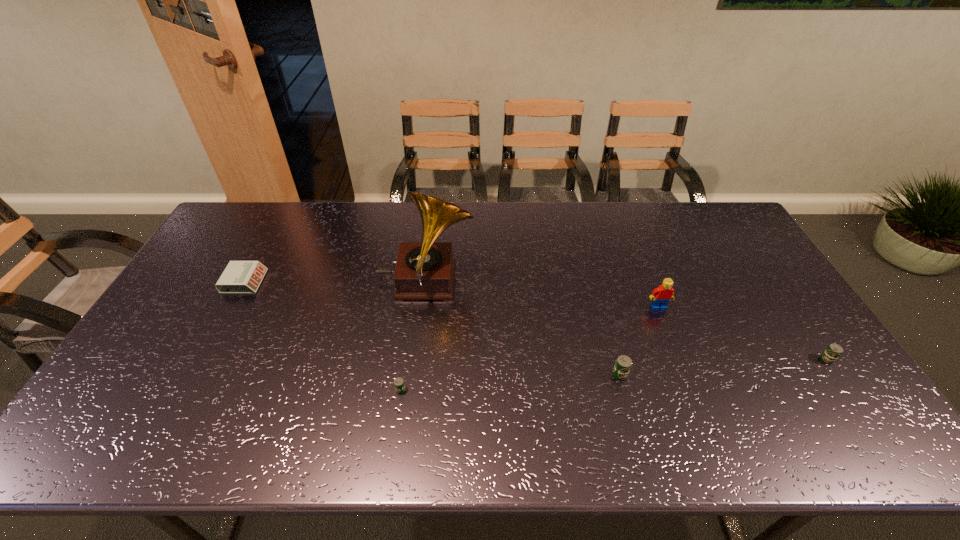
Image resolution: width=960 pixels, height=540 pixels. What are the coordinates of `the leftmost beer can` in the screenshot? It's located at (399, 384).

The width and height of the screenshot is (960, 540). What are the coordinates of `the tallest beer can` in the screenshot? It's located at (623, 364).

At what (x,y) coordinates should I click in order to perform the action: click on the third tallest object. Please return your answer as a coordinate pair (x, y). Looking at the image, I should click on (623, 364).

The width and height of the screenshot is (960, 540). What are the coordinates of `the rightmost beer can` in the screenshot? It's located at (833, 351).

Locate an element on the screen. This screenshot has height=540, width=960. the rightmost object is located at coordinates (833, 351).

Identify the location of the fifth shortest object. (662, 295).

Where is `Lego`? Lego is located at coordinates (662, 295).

Where is `the leftmost object`? the leftmost object is located at coordinates (239, 277).

The width and height of the screenshot is (960, 540). What are the coordinates of `phonograph record` in the screenshot? It's located at (425, 270).

This screenshot has width=960, height=540. I want to click on vacant region located on the left of the shortest beer can, so click(x=316, y=390).